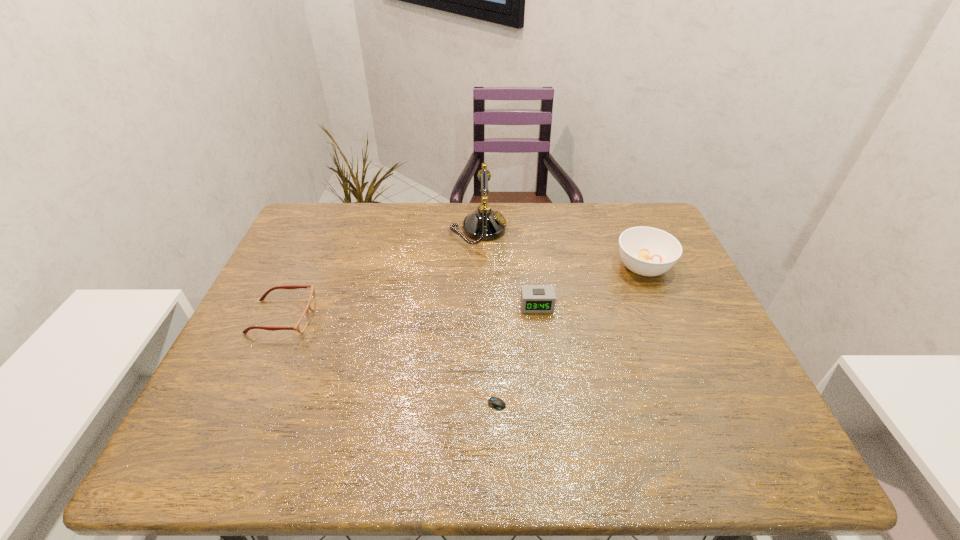
Locate an element on the screen. unoccupied area between the fourth object from left to right and the spectacles is located at coordinates (410, 312).

This screenshot has width=960, height=540. In order to click on object that ranks as the fourth closest to the spectacles in this screenshot , I will do `click(647, 251)`.

Where is `object that is the second closest to the spectacles`? object that is the second closest to the spectacles is located at coordinates (497, 403).

Identify the location of vacant region that satisfies the following two spatial constraints: 1. on the front-facing side of the spectacles; 2. on the right side of the mouse. (246, 399).

This screenshot has width=960, height=540. Find the location of `vacant point that satisfies the following two spatial constraints: 1. on the front-facing side of the spectacles; 2. on the left side of the mouse`. vacant point that satisfies the following two spatial constraints: 1. on the front-facing side of the spectacles; 2. on the left side of the mouse is located at coordinates pyautogui.click(x=246, y=399).

I want to click on vacant space that satisfies the following two spatial constraints: 1. on the front-facing side of the shortest object; 2. on the left side of the spectacles, so click(246, 399).

Where is `vacant space that satisfies the following two spatial constraints: 1. on the front-facing side of the spectacles; 2. on the right side of the shortest object`? vacant space that satisfies the following two spatial constraints: 1. on the front-facing side of the spectacles; 2. on the right side of the shortest object is located at coordinates (246, 399).